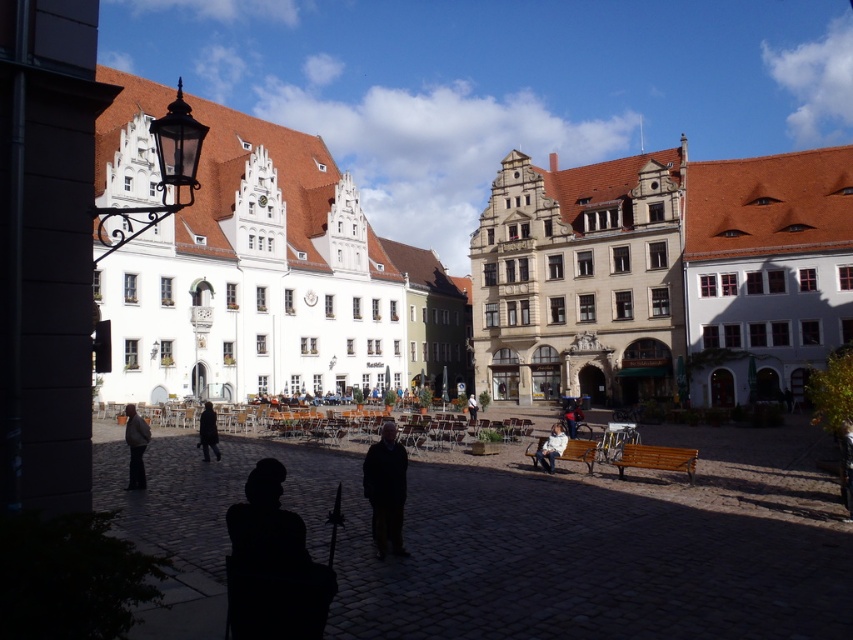
You are a tourist visiting the European town square. You see the white stone building at upper left and the silhouette fabric at center. Which object would appear closer to you if you were standing in the square?

The silhouette fabric at center would appear closer because it is smaller in size compared to the white stone building at upper left, which is larger and likely farther away.